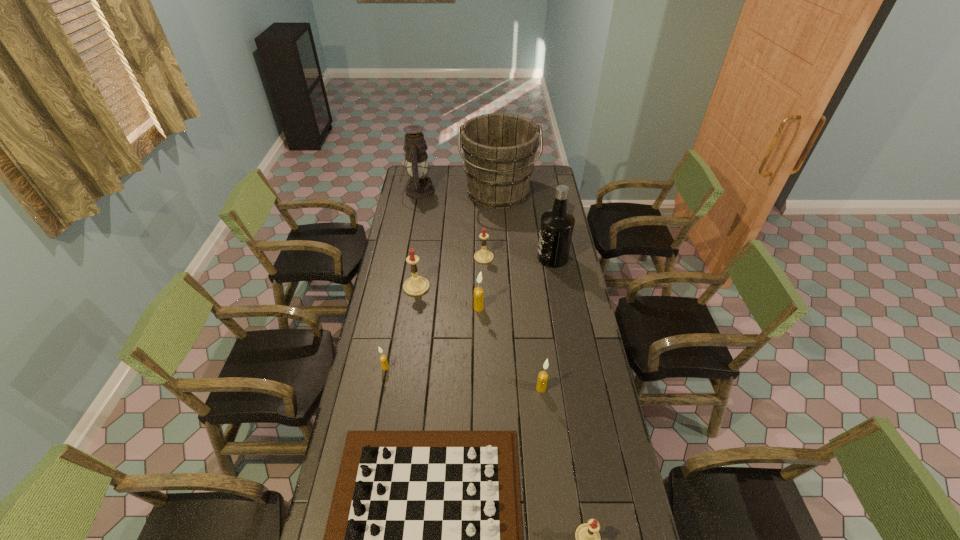
I want to click on vacant space located on the left of the second smallest red candle, so click(400, 258).

This screenshot has height=540, width=960. In order to click on vacant region located on the right of the nearest cream candle in this screenshot , I will do `click(570, 388)`.

This screenshot has width=960, height=540. Find the location of `vacant space located on the right of the fourth nearest object`. vacant space located on the right of the fourth nearest object is located at coordinates (410, 367).

Locate an element on the screen. bucket at the far edge is located at coordinates (499, 149).

Find the location of `oil lamp that is at the far edge`. oil lamp that is at the far edge is located at coordinates (419, 186).

Find the location of a particular element. This screenshot has height=540, width=960. oil lamp that is at the left edge is located at coordinates 419,186.

Find the location of a particular element. bucket at the right edge is located at coordinates (499, 149).

Locate an element on the screen. The width and height of the screenshot is (960, 540). liquor situated at the right edge is located at coordinates (557, 224).

What are the coordinates of `object that is at the far left corner` in the screenshot? It's located at (419, 186).

Identify the location of object that is positioned at the far right corner. Image resolution: width=960 pixels, height=540 pixels. click(x=499, y=149).